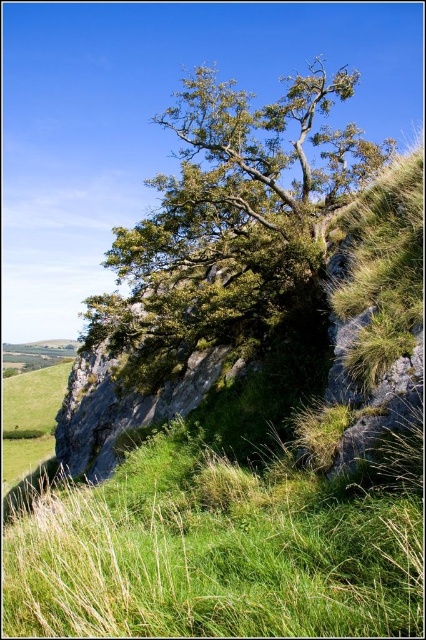
Question: Can you confirm if green grassy at lower left is bigger than green leafy tree at upper center?

Choices:
 (A) yes
 (B) no

Answer: (B)

Question: Which point appears closest to the camera in this image?

Choices:
 (A) (69, 515)
 (B) (250, 218)

Answer: (A)

Question: Is green grassy at lower left below green leafy tree at upper center?

Choices:
 (A) yes
 (B) no

Answer: (A)

Question: Is green grassy at lower left wider than green leafy tree at upper center?

Choices:
 (A) yes
 (B) no

Answer: (B)